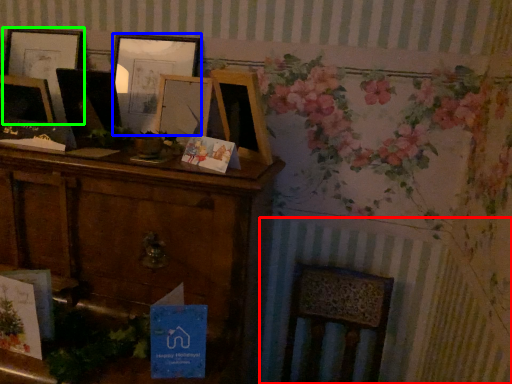
Question: Which object is the farthest from radiator (highlighted by a red box)? Choose among these: picture frame (highlighted by a blue box) or picture frame (highlighted by a green box).

Choices:
 (A) picture frame
 (B) picture frame

Answer: (B)